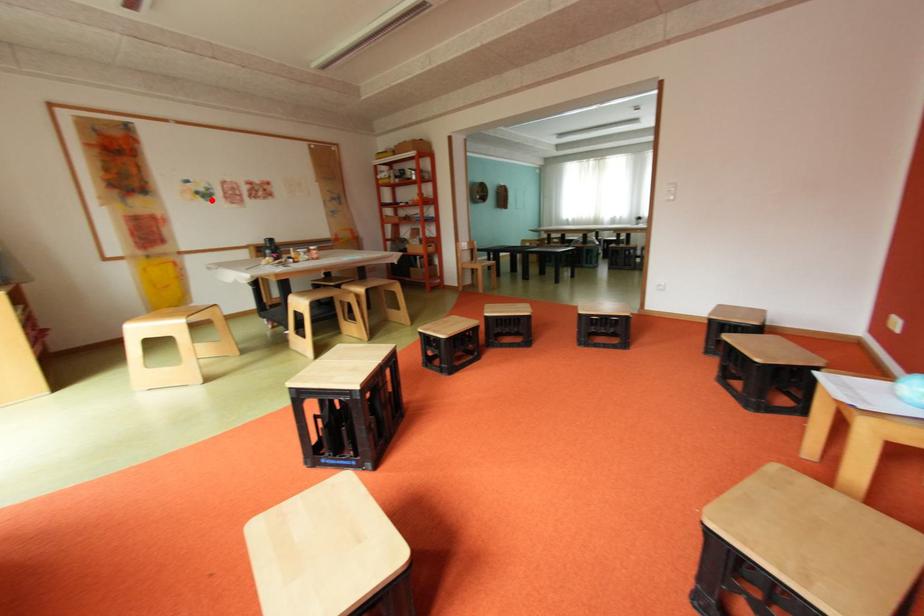
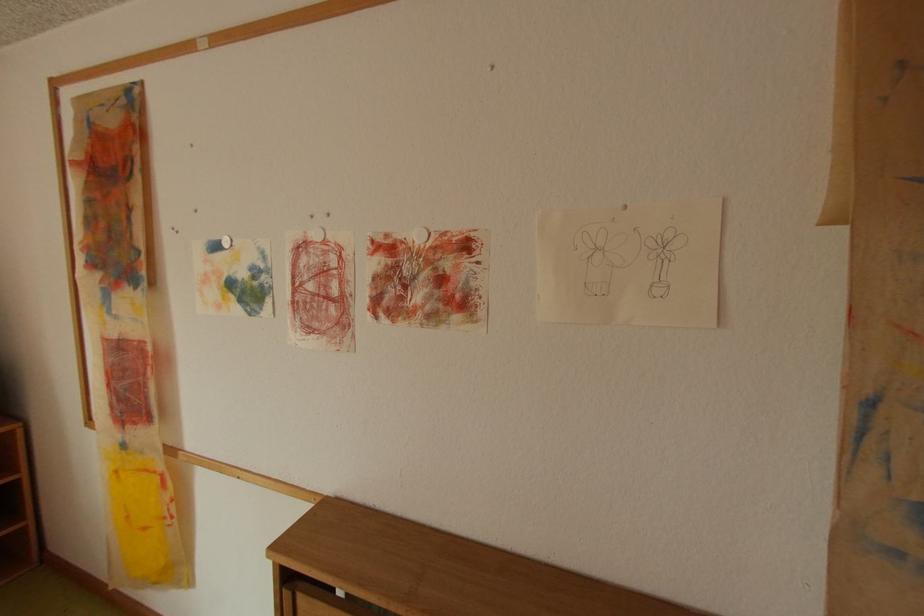
The point at the highlighted location is marked in the first image. Where is the corresponding point in the second image?

(247, 309)